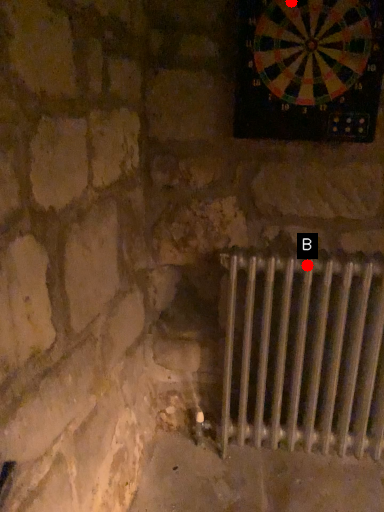
Question: Two points are circled on the image, labeled by A and B beside each circle. Among these points, which one is farthest from the camera?

Choices:
 (A) A is further
 (B) B is further

Answer: (B)